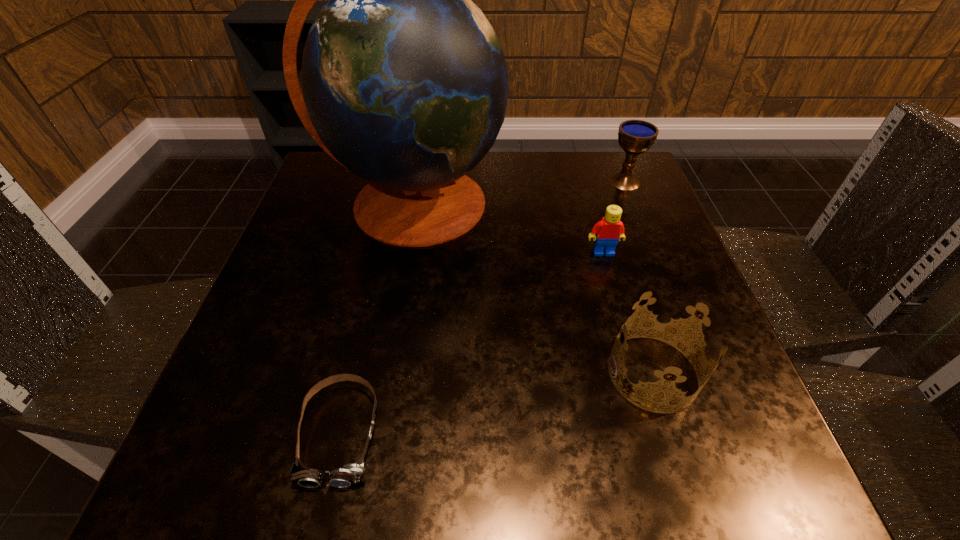
Identify the location of empty location between the shortest object and the Lego. The width and height of the screenshot is (960, 540). (471, 343).

Where is `free spot between the globe and the crown`? free spot between the globe and the crown is located at coordinates (533, 288).

The height and width of the screenshot is (540, 960). I want to click on free space that is in between the goggles and the crown, so click(x=496, y=403).

Locate an element on the screen. The width and height of the screenshot is (960, 540). blank region between the globe and the chalice is located at coordinates (519, 193).

Locate an element on the screen. vacant space that's between the chalice and the shortest object is located at coordinates 483,307.

Select which object appears as the second closest to the crown. Please provide its 2D coordinates. Your answer should be formatted as a tuple, i.e. [(x, y)], where the tuple contains the x and y coordinates of a point satisfying the conditions above.

[(404, 83)]

Image resolution: width=960 pixels, height=540 pixels. Find the location of `object that is the fourth nearest to the shortest object`. object that is the fourth nearest to the shortest object is located at coordinates (635, 137).

This screenshot has width=960, height=540. Find the location of `vacant space that satisfies the following two spatial constraints: 1. on the back side of the crown; 2. on the left side of the chalice`. vacant space that satisfies the following two spatial constraints: 1. on the back side of the crown; 2. on the left side of the chalice is located at coordinates (592, 181).

Where is `vacant area in the image that satisfies the following two spatial constraints: 1. on the face of the Lego; 2. on the left side of the crown`? The height and width of the screenshot is (540, 960). vacant area in the image that satisfies the following two spatial constraints: 1. on the face of the Lego; 2. on the left side of the crown is located at coordinates (637, 373).

Identify the location of free location that satisfies the following two spatial constraints: 1. on the face of the crown; 2. on the left side of the Lego. This screenshot has width=960, height=540. (637, 373).